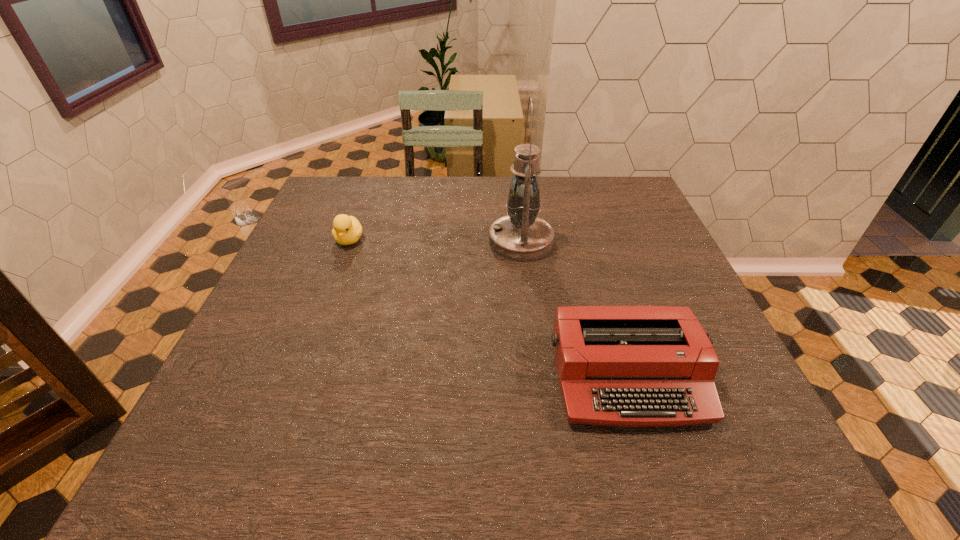
The width and height of the screenshot is (960, 540). Identify the location of vacant space that satisfies the following two spatial constraints: 1. on the front-facing side of the oil lamp; 2. on the left side of the leftmost object. (348, 241).